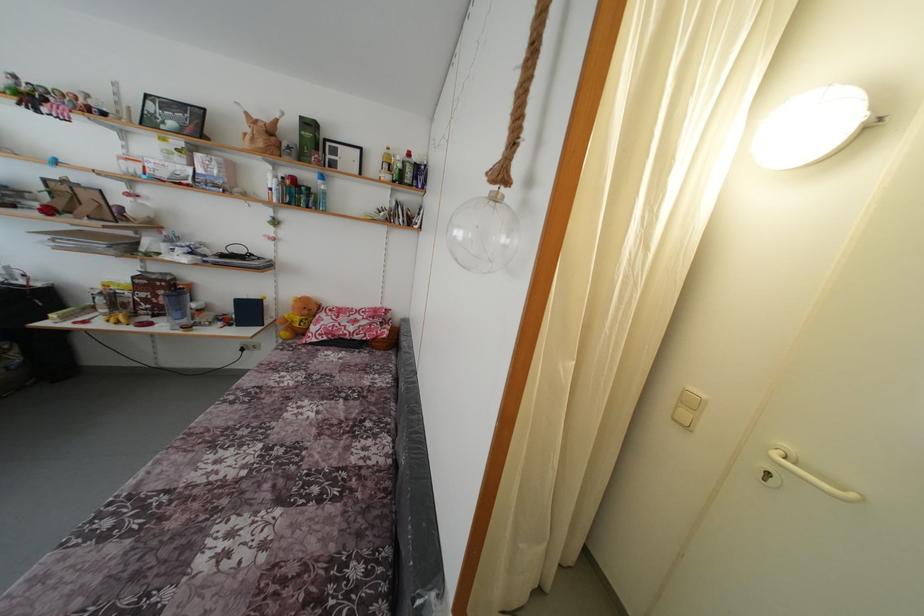
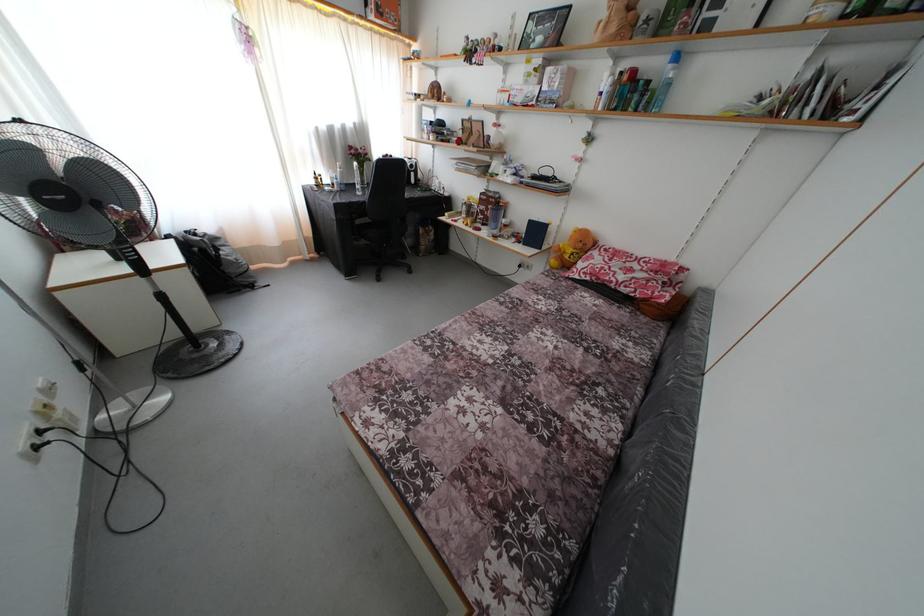
In the second image, find the point that corresponds to (x=324, y=188) in the first image.

(675, 73)